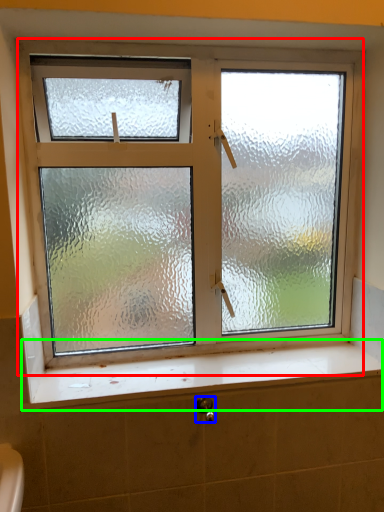
Question: Based on their relative distances, which object is farther from window (highlighted by a red box)? Choose from shower (highlighted by a blue box) and window sill (highlighted by a green box).

Choices:
 (A) shower
 (B) window sill

Answer: (A)